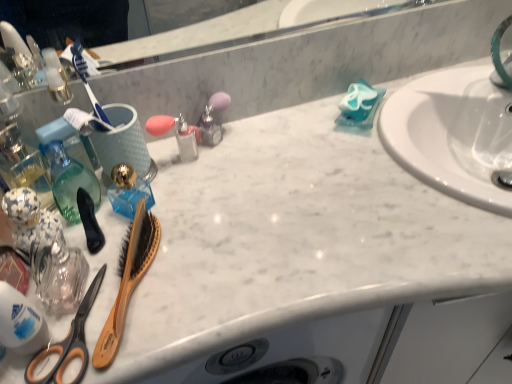
Image resolution: width=512 pixels, height=384 pixels. I want to click on empty space that is to the right of wooden bristle brush at left, the first brush when ordered from right to left, so click(x=233, y=269).